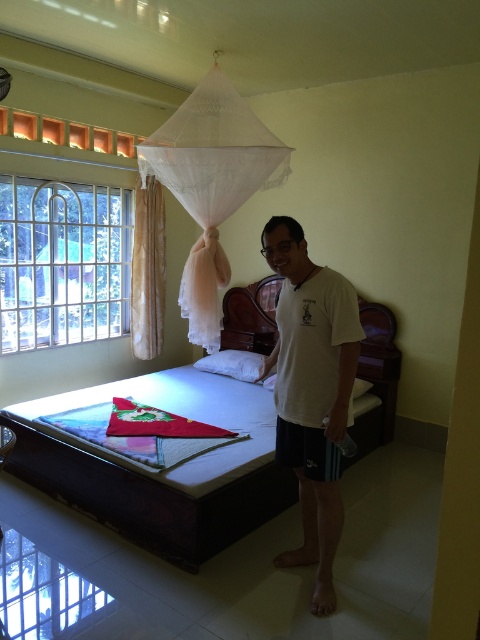
Question: Which point is closer to the camera?

Choices:
 (A) white fabric bed at center
 (B) white soft pillow at right
 (C) white matte t-shirt at center

Answer: (C)

Question: Is white sheer curtain at left above white soft pillow at right?

Choices:
 (A) no
 (B) yes

Answer: (B)

Question: Among these points, which one is farthest from the camera?

Choices:
 (A) (214, 358)
 (B) (204, 333)

Answer: (A)

Question: Is white matte t-shirt at center below white soft pillow at right?

Choices:
 (A) yes
 (B) no

Answer: (B)

Question: Can you confirm if clear glass window at left is positioned below white sheer mosquito net at upper center?

Choices:
 (A) no
 (B) yes

Answer: (B)

Question: Among these objects, which one is farthest from the camera?

Choices:
 (A) white soft pillow at right
 (B) white soft pillow at center
 (C) white fabric bed at center
 (D) white sheer curtain at left

Answer: (D)